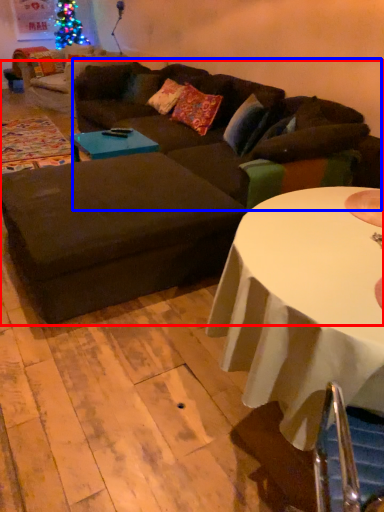
Question: Which object appears closest to the camera in this image, studio couch (highlighted by a red box) or couch (highlighted by a blue box)?

Choices:
 (A) studio couch
 (B) couch

Answer: (A)